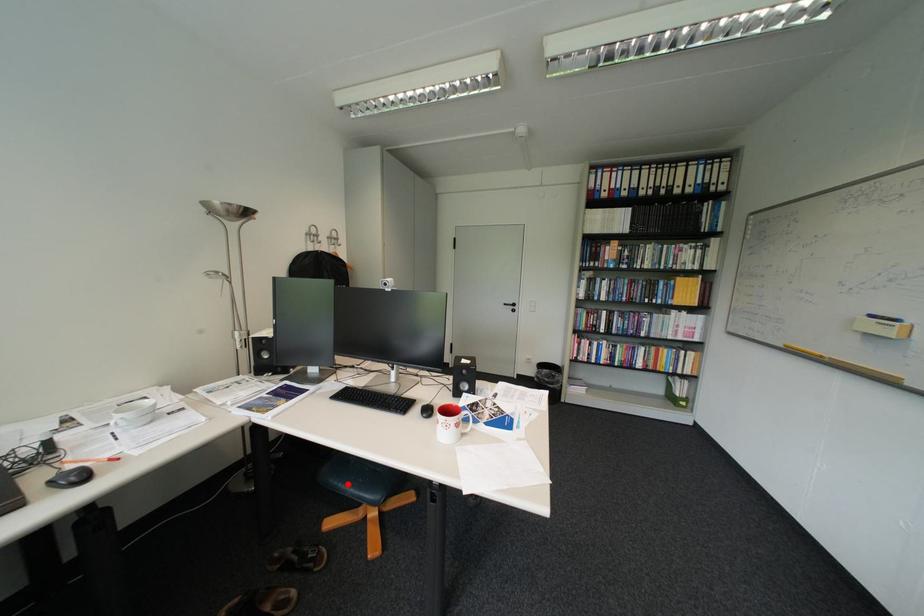
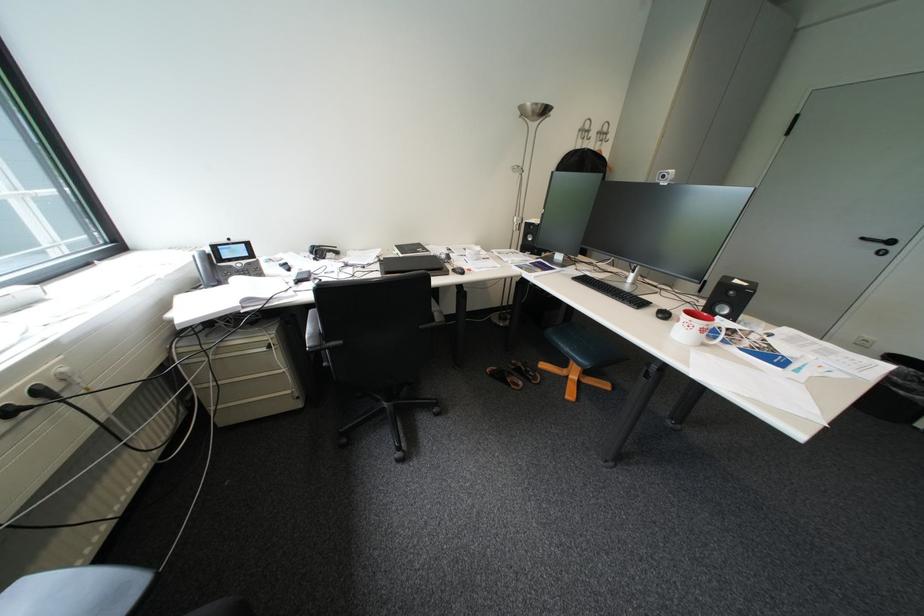
Question: I am providing you with two images of the same scene from different viewpoints. Image1 has a red point marked. In image2, the corresponding 3D location appears at what relative position? Reply with the corresponding letter.

Choices:
 (A) Closer
 (B) Farther

Answer: (A)